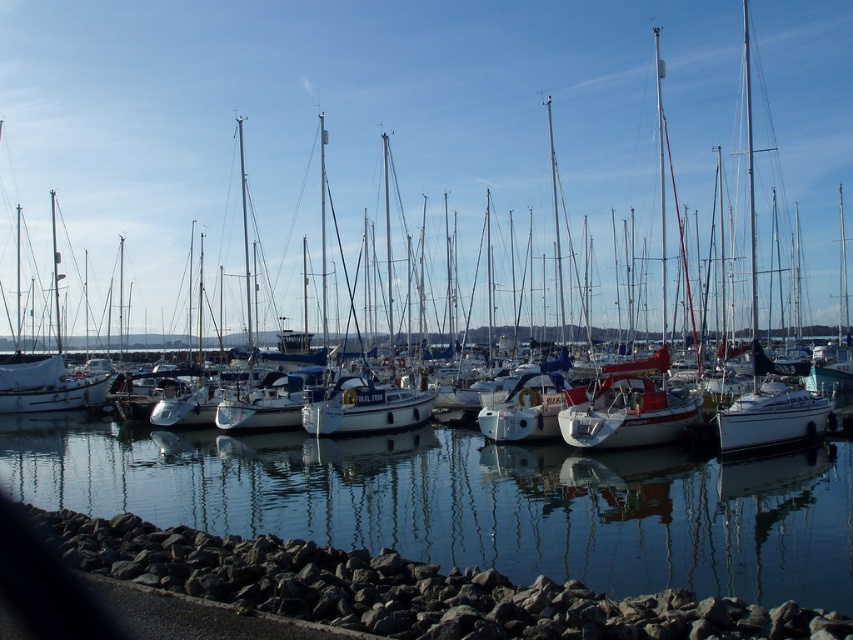
You are standing on the rocky shoreline in the foreground and want to take a photo of the white glossy boat at center. Since the clear water at center is between you and the boat, will you be able to see the boat clearly through the water?

The clear water at center is closer to the viewer than white glossy boat at center, so yes, you can see the boat clearly through the water because the water is in front of the boat and does not block the view.

You are a boat operator who needs to navigate a new boat through the marina. Considering the white glossy sailboat at center and the clear water at center, which object would you prioritize checking the width of to ensure safe passage?

You should prioritize checking the width of the white glossy sailboat at center because the description suggests it might be wider than the clear water at center, which could affect navigation.